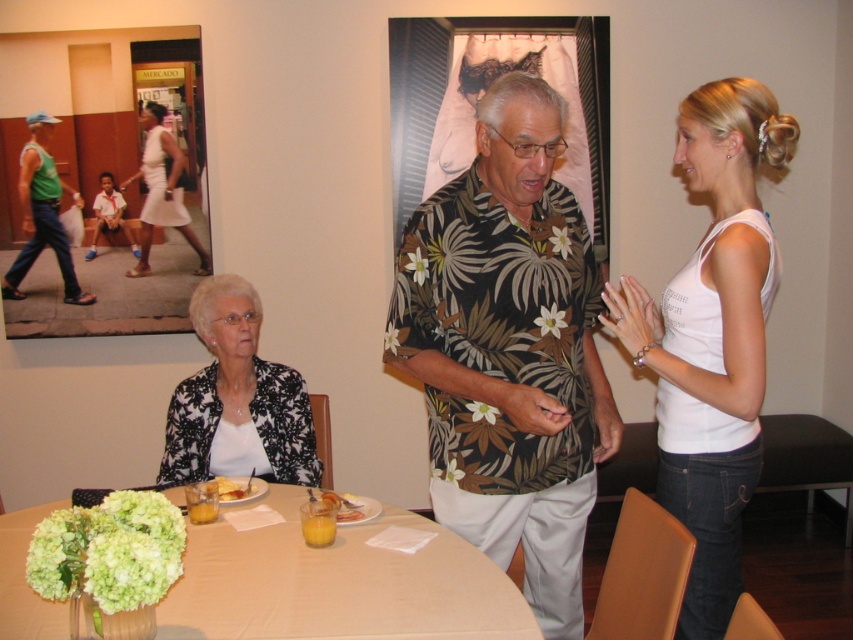
Can you confirm if floral print shirt at center is positioned above yellow matte plate at center?

Yes.

I want to click on floral print shirt at center, so click(x=509, y=349).

Locate an element on the screen. The height and width of the screenshot is (640, 853). floral print shirt at center is located at coordinates (509, 349).

Is black printed fabric at lower left further to camera compared to white satin dress at upper left?

That is False.

Between black printed fabric at lower left and white satin dress at upper left, which one appears on the left side from the viewer's perspective?

From the viewer's perspective, white satin dress at upper left appears more on the left side.

Find the location of a particular element. This screenshot has height=640, width=853. black printed fabric at lower left is located at coordinates (236, 400).

Is floral print shirt at center above yellow cake at table?

Correct, floral print shirt at center is located above yellow cake at table.

How far apart are floral print shirt at center and yellow cake at table?

A distance of 33.50 inches exists between floral print shirt at center and yellow cake at table.

Which is behind, point (524, 424) or point (252, 493)?

The point (252, 493) is more distant.

In order to click on floral print shirt at center in this screenshot , I will do `click(509, 349)`.